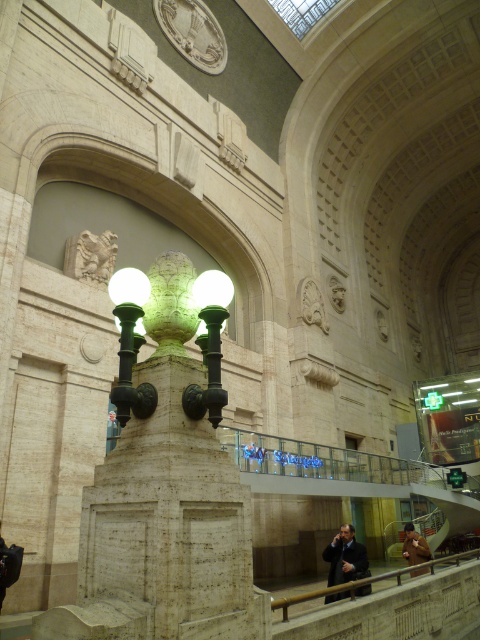
Does point (121, 400) come closer to viewer compared to point (312, 593)?

Yes.

Is green polished stone lamp post at center positioned before polished wood railing at lower right?

Yes, green polished stone lamp post at center is closer to the viewer.

Between point (123, 410) and point (324, 589), which one is positioned behind?

The point (324, 589) is more distant.

In order to click on green polished stone lamp post at center in this screenshot , I will do `click(127, 332)`.

Between dark suit at center and brown leather jacket at lower right, which one has less height?

With less height is brown leather jacket at lower right.

Is point (340, 572) farther from viewer compared to point (418, 540)?

That is False.

Describe the element at coordinates (346, 557) in the screenshot. I see `dark suit at center` at that location.

I want to click on dark suit at center, so click(x=346, y=557).

The width and height of the screenshot is (480, 640). What do you see at coordinates (127, 332) in the screenshot?
I see `green polished stone lamp post at center` at bounding box center [127, 332].

Does green polished stone lamp post at center appear on the left side of brown leather jacket at lower right?

Yes, green polished stone lamp post at center is to the left of brown leather jacket at lower right.

This screenshot has height=640, width=480. Describe the element at coordinates (127, 332) in the screenshot. I see `green polished stone lamp post at center` at that location.

Where is `green polished stone lamp post at center`? Image resolution: width=480 pixels, height=640 pixels. green polished stone lamp post at center is located at coordinates (127, 332).